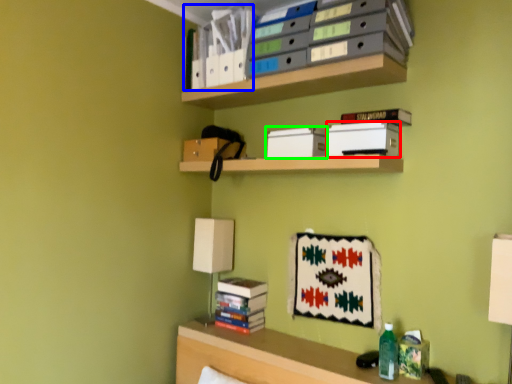
Question: Estimate the real-world distances between objects in this image. Which object is farther from paperback book (highlighted by a red box), book (highlighted by a blue box) or paperback book (highlighted by a green box)?

Choices:
 (A) book
 (B) paperback book

Answer: (A)